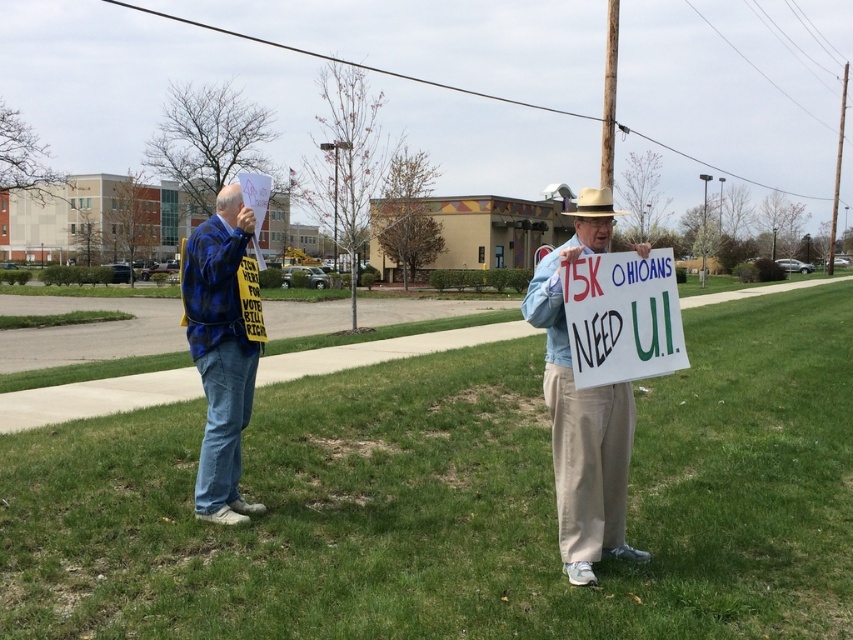
Which is below, blue plaid shirt at left or brown felt cowboy hat at center?

blue plaid shirt at left

Which of these two, blue plaid shirt at left or brown felt cowboy hat at center, stands shorter?

blue plaid shirt at left is shorter.

Where is `blue plaid shirt at left`? blue plaid shirt at left is located at coordinates (219, 353).

Locate an element on the screen. blue plaid shirt at left is located at coordinates (219, 353).

Which of these two, blue plaid shirt at left or white cardboard sign at center, stands shorter?

Standing shorter between the two is white cardboard sign at center.

Can you confirm if blue plaid shirt at left is smaller than white cardboard sign at center?

Actually, blue plaid shirt at left might be larger than white cardboard sign at center.

Does point (254, 371) come closer to viewer compared to point (596, 253)?

No, (254, 371) is further to viewer.

Find the location of a particular element. The width and height of the screenshot is (853, 640). blue plaid shirt at left is located at coordinates (219, 353).

Does white cardboard sign at center have a greater height compared to brown felt cowboy hat at center?

In fact, white cardboard sign at center may be shorter than brown felt cowboy hat at center.

Between white cardboard sign at center and brown felt cowboy hat at center, which one appears on the left side from the viewer's perspective?

white cardboard sign at center

Is point (682, 356) farther from camera compared to point (579, 205)?

Yes, it is behind point (579, 205).

The width and height of the screenshot is (853, 640). I want to click on white cardboard sign at center, so click(x=622, y=316).